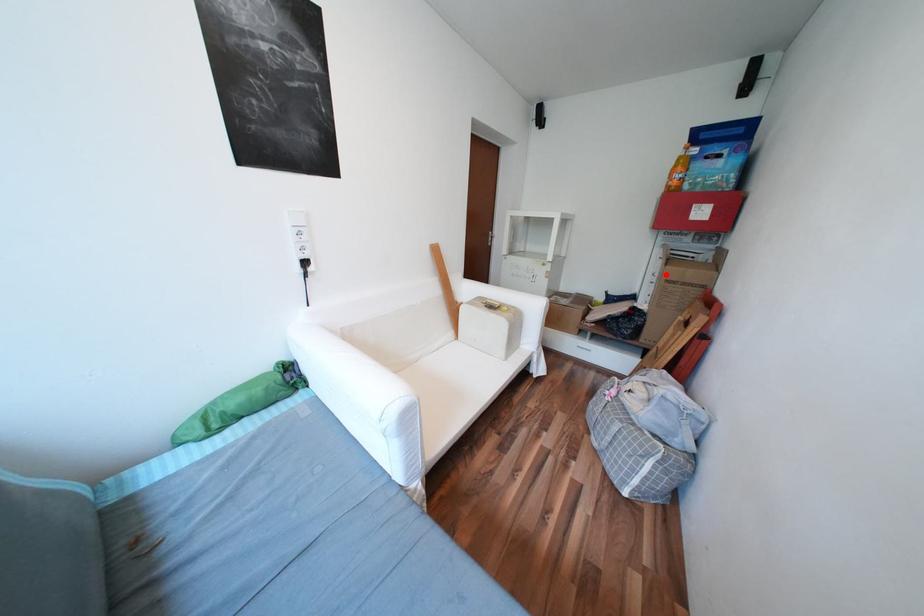
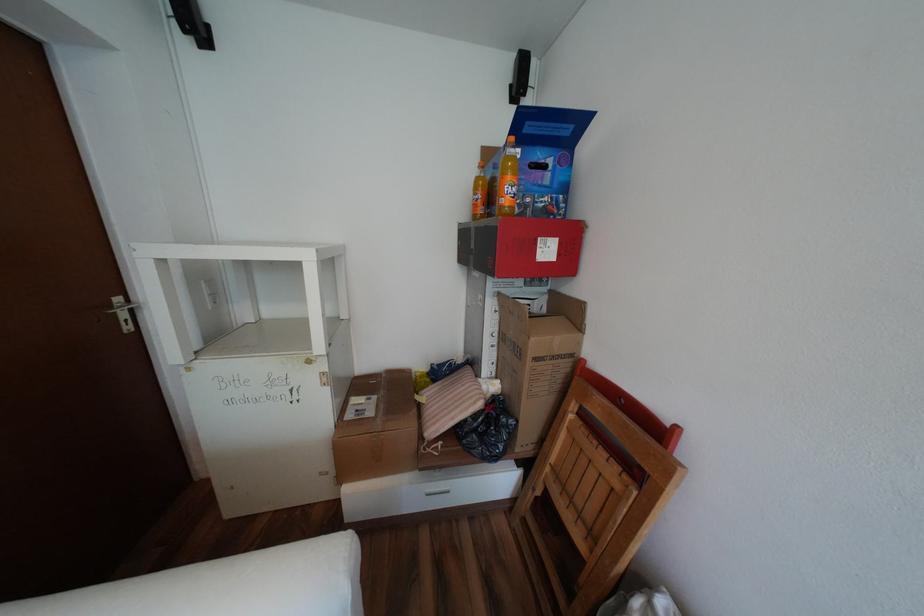
Question: I am providing you with two images of the same scene from different viewpoints. A red point is shown in image1. For the corresponding object point in image2, is it positioned nearer or farther from the camera?

Choices:
 (A) Nearer
 (B) Farther

Answer: (B)